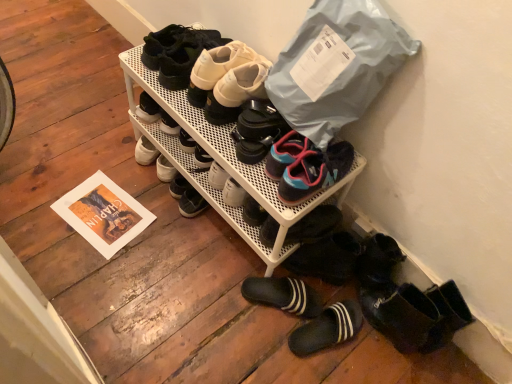
Where is `free spot in front of black rubber slippers at lower center, the 1th footwear in the bottom-to-top sequence`? free spot in front of black rubber slippers at lower center, the 1th footwear in the bottom-to-top sequence is located at coordinates (314, 364).